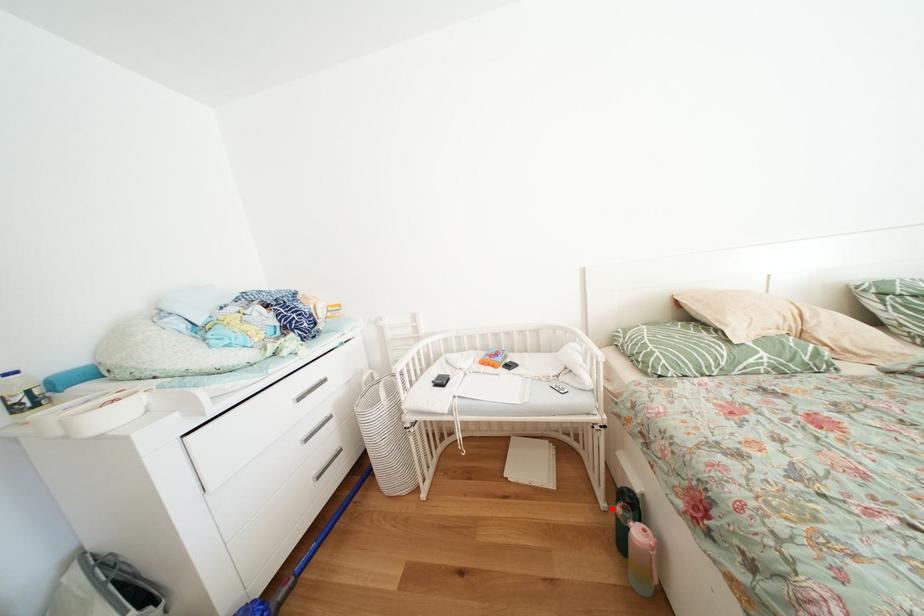
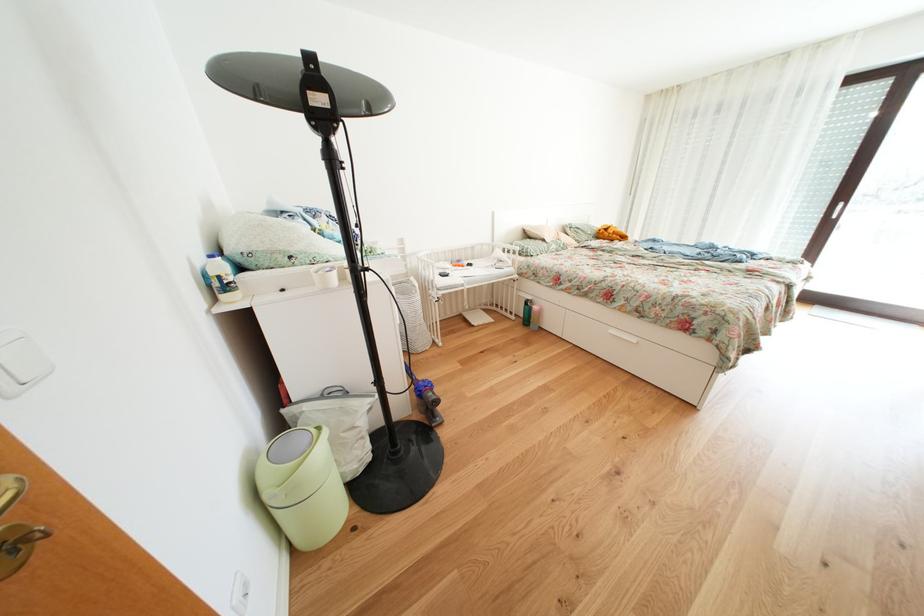
Find the pixel in the second image that matches the highlighted location in the first image.

(523, 323)